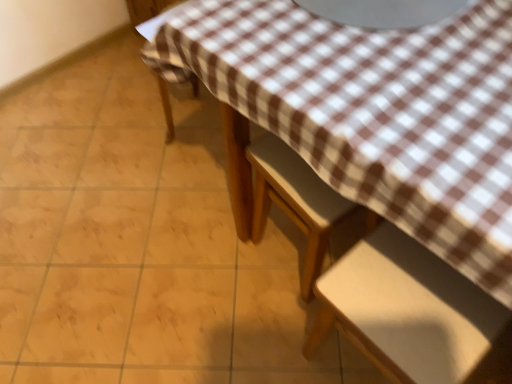
Question: Choose the correct answer: Is brown checkered tablecloth at upper center inside wooden chair at center, placed as the second chair when sorted from top to bottom, or outside it?

Choices:
 (A) outside
 (B) inside

Answer: (A)

Question: In terms of width, does brown checkered tablecloth at upper center look wider or thinner when compared to wooden chair at center, placed as the second chair when sorted from top to bottom?

Choices:
 (A) thin
 (B) wide

Answer: (B)

Question: Considering the real-world distances, which object is farthest from the brown checkered tablecloth at upper center?

Choices:
 (A) brown checkered fabric at lower left, which is the first chair in top-to-bottom order
 (B) white matte chair at lower right, the first chair in the bottom-to-top sequence
 (C) wooden chair at center, placed as the second chair when sorted from top to bottom

Answer: (A)

Question: Which object is positioned farthest from the brown checkered tablecloth at upper center?

Choices:
 (A) brown checkered fabric at lower left, which is the first chair in top-to-bottom order
 (B) wooden chair at center, which is the second chair in bottom-to-top order
 (C) white matte chair at lower right, marked as the 3th chair in a top-to-bottom arrangement

Answer: (A)